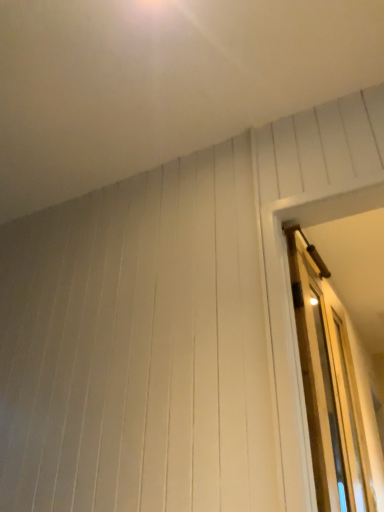
Locate an element on the screen. clear glass door at right is located at coordinates (328, 387).

What do you see at coordinates (328, 387) in the screenshot? This screenshot has height=512, width=384. I see `clear glass door at right` at bounding box center [328, 387].

This screenshot has height=512, width=384. I want to click on clear glass door at right, so click(328, 387).